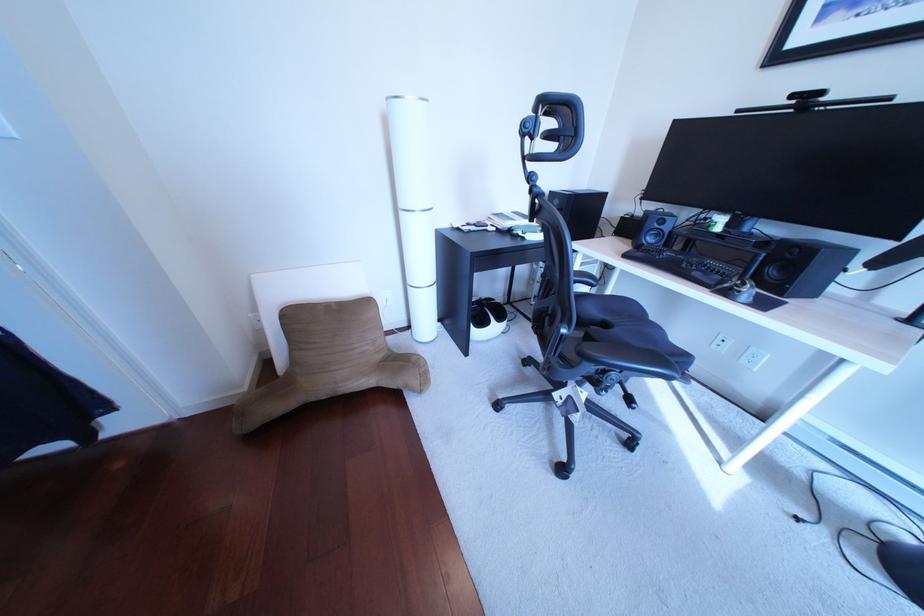
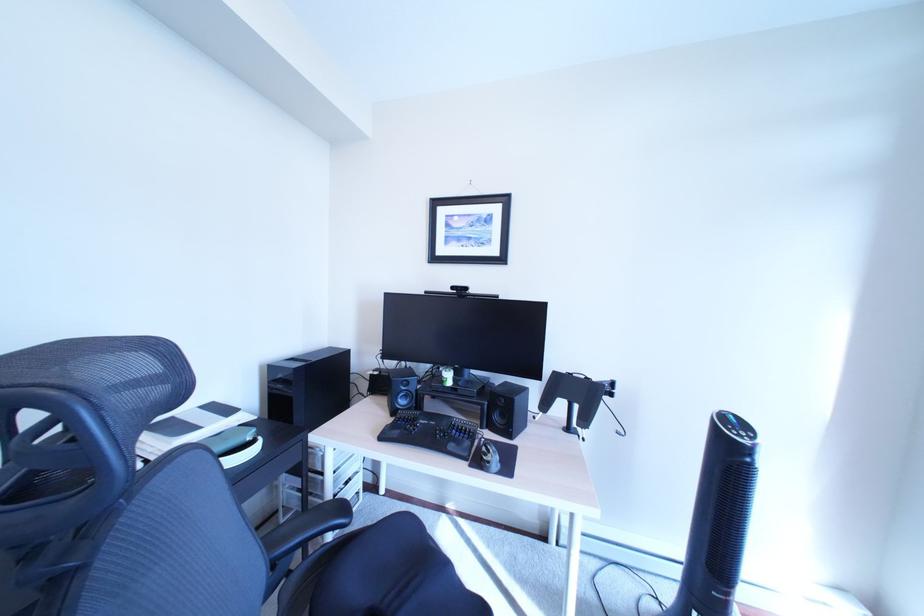
The images are taken continuously from a first-person perspective. In which direction is your viewpoint rotating?

The camera rotated toward right-up.